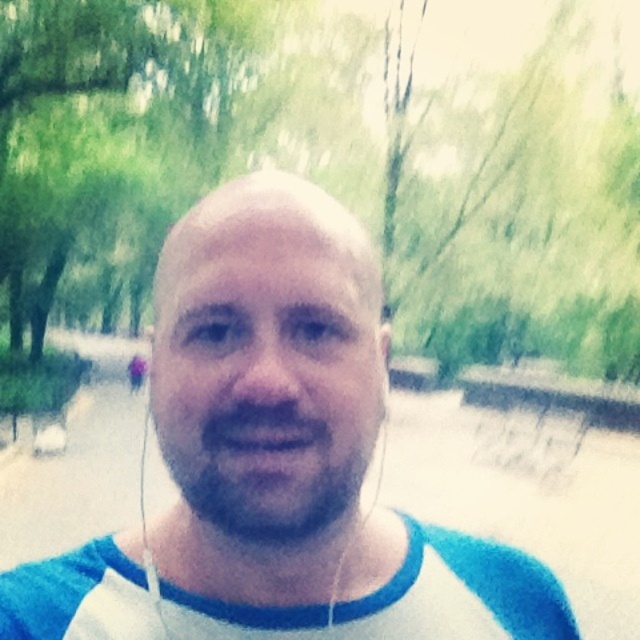
Between white fabric shirt at center and beardsoftat center, which one has less height?

Standing shorter between the two is white fabric shirt at center.

Where is `white fabric shirt at center`? The height and width of the screenshot is (640, 640). white fabric shirt at center is located at coordinates (276, 458).

This screenshot has height=640, width=640. What are the coordinates of `white fabric shirt at center` in the screenshot? It's located at (276, 458).